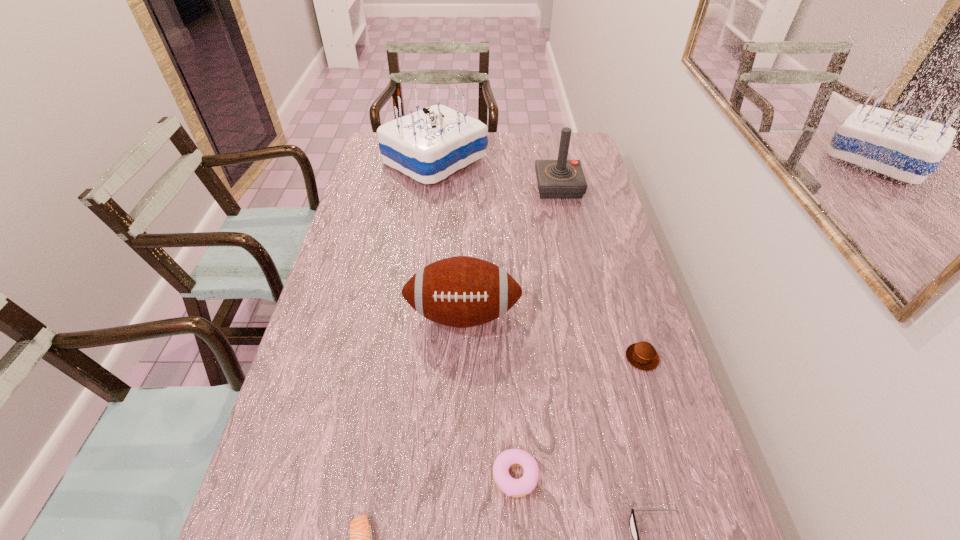
Locate an element on the screen. This screenshot has height=540, width=960. the tallest object is located at coordinates (428, 145).

This screenshot has height=540, width=960. I want to click on the second tallest object, so click(557, 179).

Find the location of a particular element. This screenshot has width=960, height=540. football is located at coordinates (461, 291).

Find the location of a particular element. The image size is (960, 540). the fifth shortest object is located at coordinates (461, 291).

This screenshot has height=540, width=960. I want to click on the fourth shortest object, so click(x=642, y=355).

Locate an element on the screen. This screenshot has height=540, width=960. the fourth nearest object is located at coordinates (642, 355).

Locate an element on the screen. The image size is (960, 540). the third nearest object is located at coordinates (526, 484).

Identify the location of free region located 0.160m on the front of the tallest object. (427, 220).

Locate an element on the screen. The height and width of the screenshot is (540, 960). blank space located 0.220m on the rectangular base of the second tallest object is located at coordinates (476, 186).

You are a GUI agent. You are given a task and a screenshot of the screen. Output one action in this format:
    pyautogui.click(x=<x>, y=<y>)
    Task: Click on the vacant space located 0.380m on the rectangular base of the second tallest object
    The image size is (960, 540).
    Given the screenshot: What is the action you would take?
    pyautogui.click(x=432, y=186)